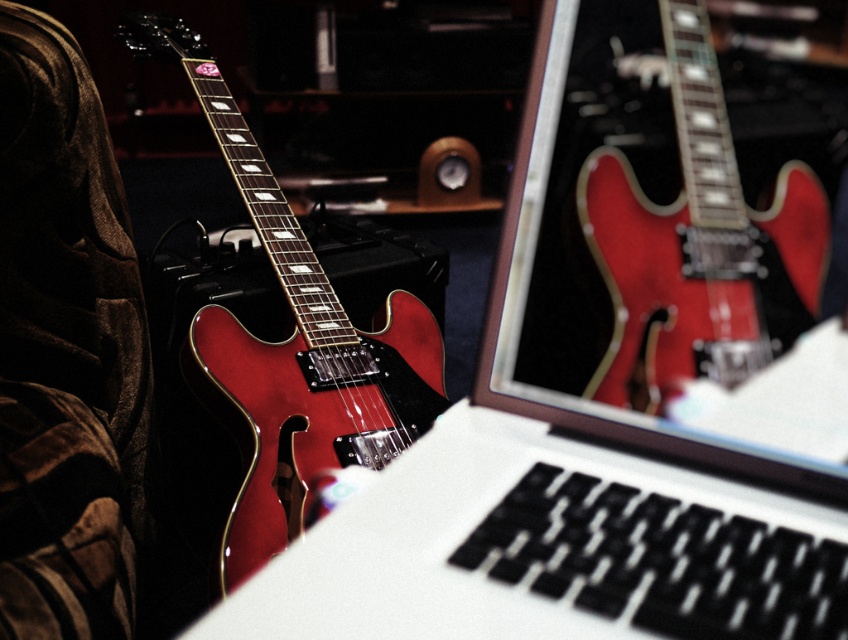
You are a music producer in a studio. You see two glossy red guitars. One is the glossy red electric guitar at center and the other is the glossy red guitar at left. Which one is positioned to the right of the other?

The glossy red electric guitar at center is positioned to the right of the glossy red guitar at left.

Please describe the exact location of the glossy red electric guitar at center in the image using coordinates.

The glossy red electric guitar at center is located at coordinates point (696, 244).

You are a photographer setting up a shoot in the music studio. You need to position a light source to illuminate both the glossy red electric guitar at center and the glossy red guitar at left. Based on their positions, which guitar should you place the light closer to if you want to ensure both receive equal lighting intensity?

The glossy red electric guitar at center is below the glossy red guitar at left. To ensure equal lighting intensity, the light should be placed closer to the glossy red electric guitar at center since it is farther from the light source compared to the glossy red guitar at left.